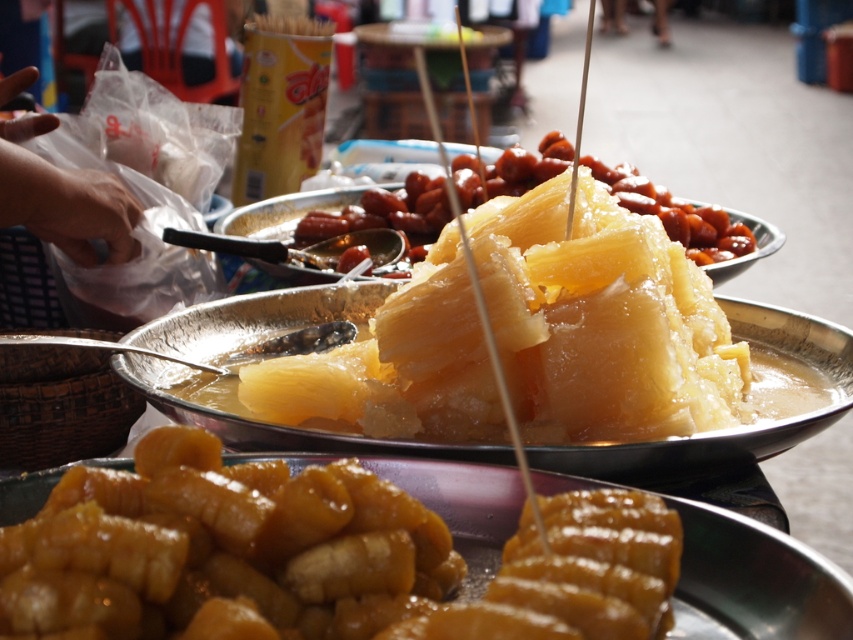
Question: Among these points, which one is farthest from the camera?

Choices:
 (A) (511, 285)
 (B) (55, 204)

Answer: (B)

Question: Where is translucent yellow gelatinous at center located in relation to translucent sugar-coated pineapple at center in the image?

Choices:
 (A) right
 (B) left

Answer: (A)

Question: Which point is farther to the camera?

Choices:
 (A) smooth plastic bag at left
 (B) golden brown dough at center

Answer: (A)

Question: Is golden brown dough at center closer to camera compared to translucent sugar-coated pineapple at center?

Choices:
 (A) yes
 (B) no

Answer: (A)

Question: Does translucent yellow gelatinous at center lie behind smooth plastic bag at left?

Choices:
 (A) yes
 (B) no

Answer: (B)

Question: Among these points, which one is nearest to the camera?

Choices:
 (A) (349, 625)
 (B) (384, 170)
 (C) (96, 209)

Answer: (A)